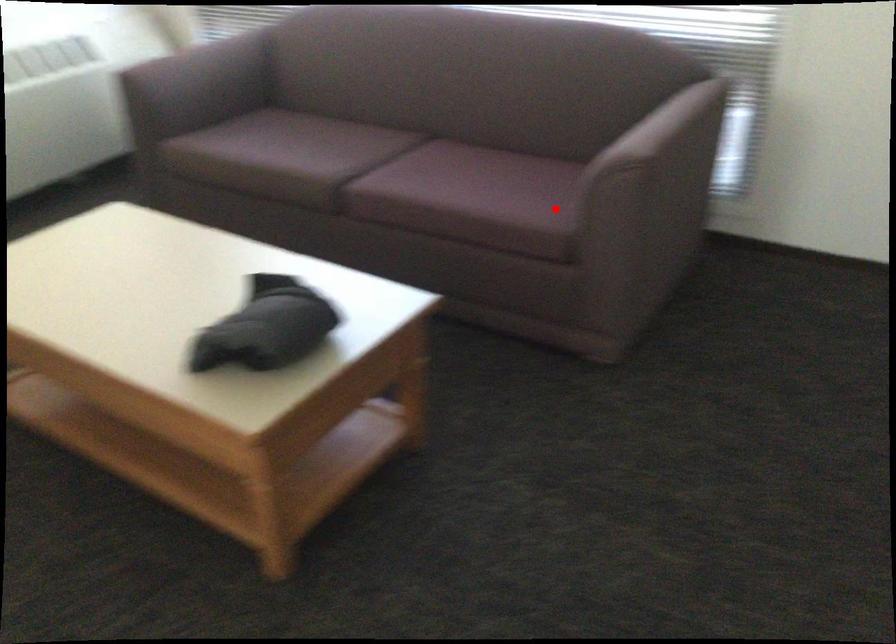
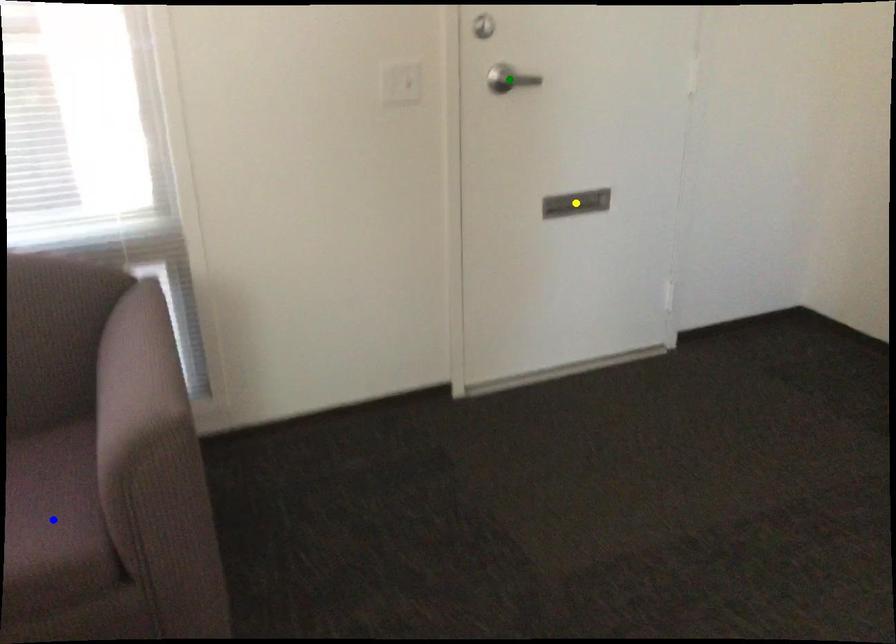
Question: I am providing you with two images of the same scene from different viewpoints. A red point is marked on the first image. You are given multiple points on the second image. Can you choose the point in image 2 that corresponds to the point in image 1?

Choices:
 (A) yellow point
 (B) blue point
 (C) green point

Answer: (B)